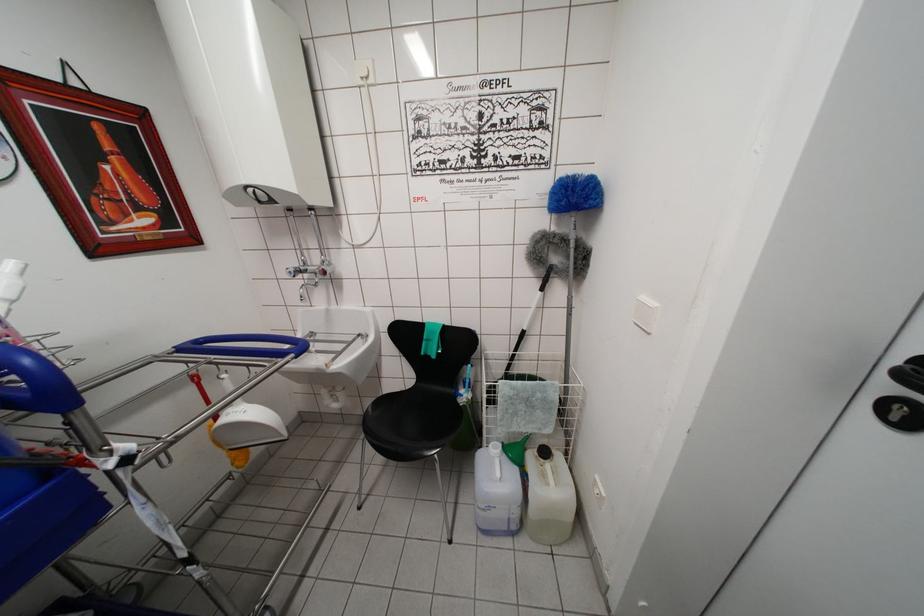
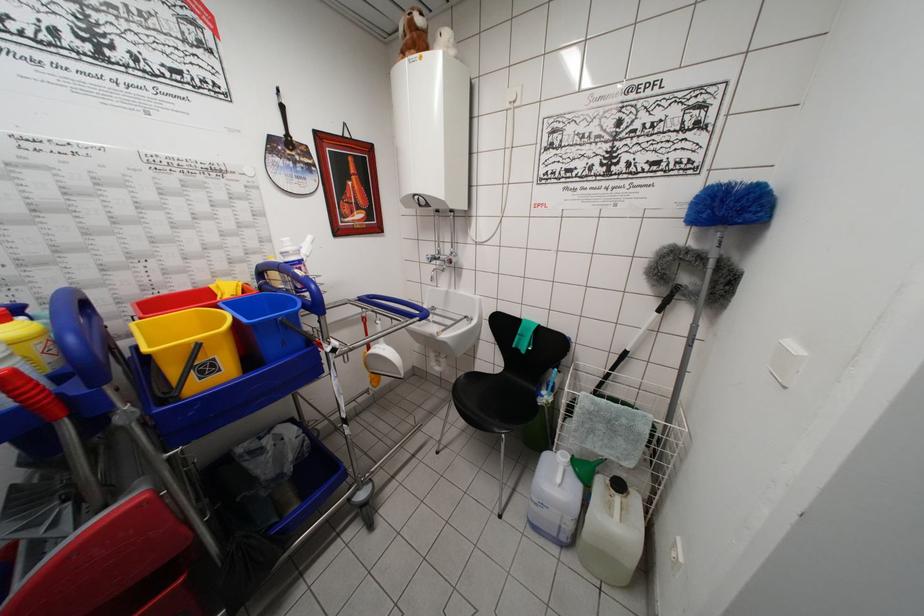
Find the pixel in the second image that matches the point at 293,277 in the first image.

(432, 262)